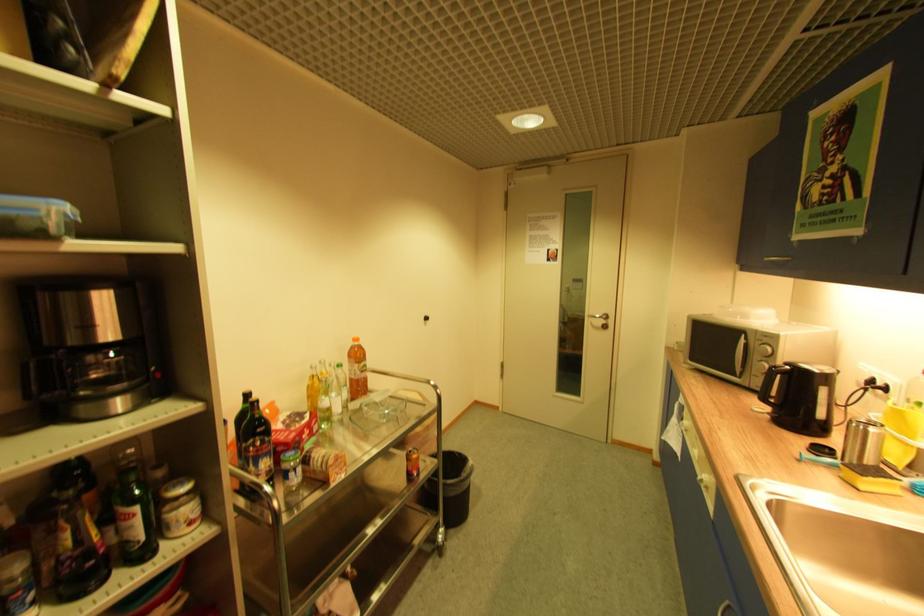
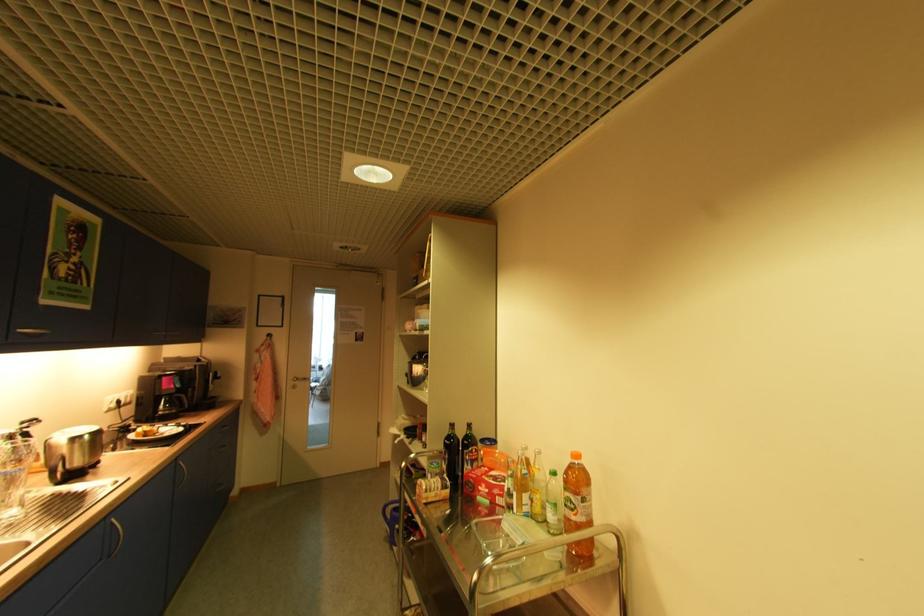
Where in the second image is the point corresponding to the point at 320,440 from the first image?

(492, 503)